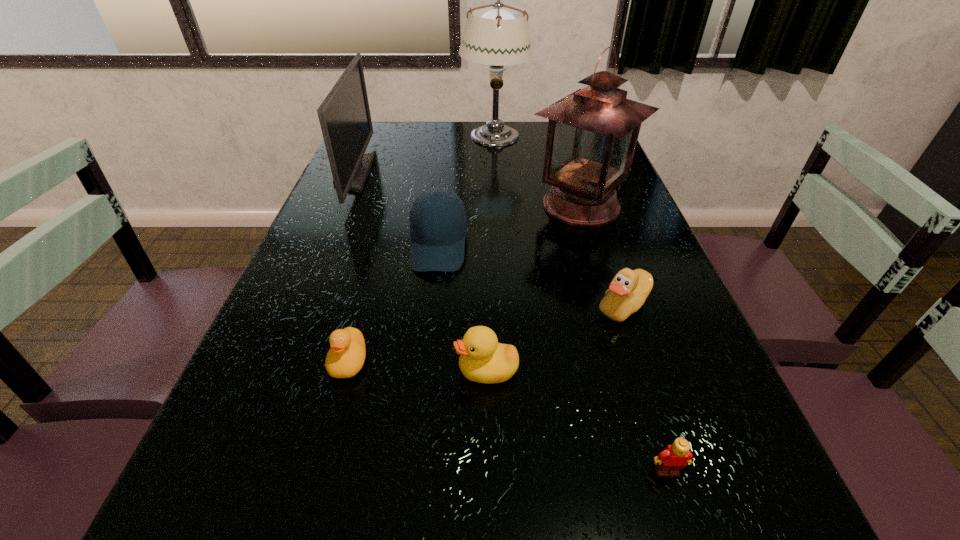
Locate an element on the screen. The width and height of the screenshot is (960, 540). free region at the far edge of the desktop is located at coordinates (450, 123).

The width and height of the screenshot is (960, 540). Find the location of `vacant space at the left edge of the desktop`. vacant space at the left edge of the desktop is located at coordinates (295, 288).

In the image, there is a desktop. Find the location of `free space at the right edge`. free space at the right edge is located at coordinates (733, 461).

Where is `free space between the second duck from left to right and the Lego`? This screenshot has width=960, height=540. free space between the second duck from left to right and the Lego is located at coordinates (577, 421).

In order to click on vacant area that lies between the oil lamp and the rightmost duck in this screenshot , I will do `click(602, 256)`.

Locate an element on the screen. Image resolution: width=960 pixels, height=540 pixels. vacant space that is in between the baseball cap and the oil lamp is located at coordinates (510, 226).

Identify the location of unoccupied position between the leftmost duck and the baseball cap. The width and height of the screenshot is (960, 540). (394, 303).

Find the location of `empty space between the oil lamp and the lampshade`. empty space between the oil lamp and the lampshade is located at coordinates (538, 171).

You are a GUI agent. You are given a task and a screenshot of the screen. Output one action in this format:
    pyautogui.click(x=<x>, y=<y>)
    Task: Click on the empty space between the farthest duck and the nearest object
    
    Given the screenshot: What is the action you would take?
    pyautogui.click(x=645, y=389)

Locate an element on the screen. free space that is in between the leftmost duck and the Lego is located at coordinates (508, 416).